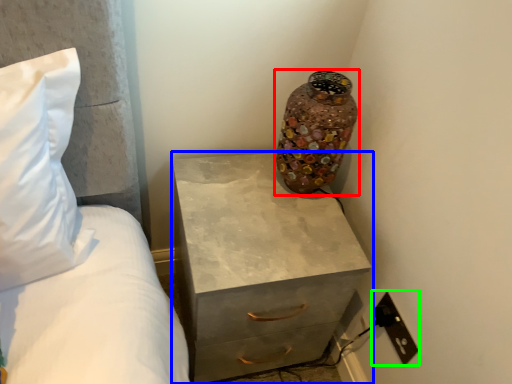
Question: Based on their relative distances, which object is nearer to vase (highlighted by a red box)? Choose from chest of drawers (highlighted by a blue box) and electric outlet (highlighted by a green box).

Choices:
 (A) chest of drawers
 (B) electric outlet

Answer: (A)